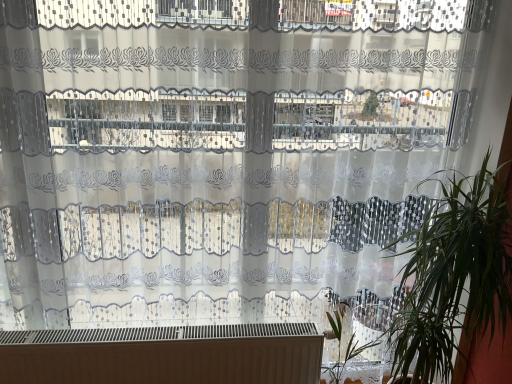
The width and height of the screenshot is (512, 384). What are the coordinates of `green leafy plant at right` in the screenshot? It's located at point(454,275).

What is the approximate width of white matte heater at bottom?

white matte heater at bottom is 12.60 centimeters wide.

What are the coordinates of `green leafy plant at right` in the screenshot? It's located at (454, 275).

Is white matte heater at bottom oriented towards green leafy plant at right?

No, white matte heater at bottom is not facing towards green leafy plant at right.

Is there a large distance between white matte heater at bottom and green leafy plant at right?

white matte heater at bottom is near green leafy plant at right, not far away.

From the picture: How different are the orientations of white matte heater at bottom and green leafy plant at right in degrees?

The angle between the facing direction of white matte heater at bottom and the facing direction of green leafy plant at right is 0.516 degrees.

Based on the photo, between white matte heater at bottom and green leafy plant at right, which one appears on the left side from the viewer's perspective?

white matte heater at bottom.

Are green leafy plant at lower right and white matte heater at bottom located far from each other?

green leafy plant at lower right is actually quite close to white matte heater at bottom.

From the image's perspective, is green leafy plant at lower right over white matte heater at bottom?

Indeed, from the image's perspective, green leafy plant at lower right is shown above white matte heater at bottom.

Is green leafy plant at lower right wider or thinner than white matte heater at bottom?

Clearly, green leafy plant at lower right has more width compared to white matte heater at bottom.

Is green leafy plant at lower right turned away from white matte heater at bottom?

Yes, green leafy plant at lower right is positioned with its back facing white matte heater at bottom.

From a real-world perspective, which is physically below, green leafy plant at right or white matte heater at bottom?

white matte heater at bottom.

Who is bigger, green leafy plant at right or white matte heater at bottom?

Bigger between the two is green leafy plant at right.

Do you think green leafy plant at right is within white matte heater at bottom, or outside of it?

green leafy plant at right lies outside white matte heater at bottom.

How many degrees apart are the facing directions of green leafy plant at right and white matte heater at bottom?

They differ by 0.516 degrees in their facing directions.

Between green leafy plant at lower right and green leafy plant at right, which one appears on the right side from the viewer's perspective?

From the viewer's perspective, green leafy plant at right appears more on the right side.

From the image's perspective, is green leafy plant at lower right above or below green leafy plant at right?

From the image's perspective, green leafy plant at lower right appears below green leafy plant at right.

Can you tell me how much green leafy plant at lower right and green leafy plant at right differ in facing direction?

green leafy plant at lower right and green leafy plant at right are facing 5.38e-05 degrees away from each other.

Between green leafy plant at lower right and green leafy plant at right, which one is positioned in front?

Positioned in front is green leafy plant at right.

Does green leafy plant at right appear on the right side of green leafy plant at lower right?

Correct, you'll find green leafy plant at right to the right of green leafy plant at lower right.

Is green leafy plant at right not close to green leafy plant at lower right?

No, green leafy plant at right is not far away from green leafy plant at lower right.

Is green leafy plant at right bigger or smaller than green leafy plant at lower right?

green leafy plant at right is bigger than green leafy plant at lower right.

Considering the sizes of objects green leafy plant at right and green leafy plant at lower right in the image provided, who is wider, green leafy plant at right or green leafy plant at lower right?

With larger width is green leafy plant at right.

Is green leafy plant at lower right surrounded by white matte heater at bottom?

No, white matte heater at bottom does not contain green leafy plant at lower right.

From a real-world perspective, is white matte heater at bottom located beneath green leafy plant at lower right?

Correct, in the physical world, white matte heater at bottom is lower than green leafy plant at lower right.

Which object is closer to the camera, white matte heater at bottom or green leafy plant at lower right?

green leafy plant at lower right is in front.

From the image's perspective, is white matte heater at bottom located above green leafy plant at lower right?

No, from the image's perspective, white matte heater at bottom is not on top of green leafy plant at lower right.

You are a GUI agent. You are given a task and a screenshot of the screen. Output one action in this format:
    pyautogui.click(x=<x>, y=<y>)
    Task: Click on the houseplant above the white matte heater at bottom (from the image's perspective)
    Image resolution: width=512 pixels, height=384 pixels.
    Given the screenshot: What is the action you would take?
    pyautogui.click(x=454, y=275)

Locate an element on the screen. This screenshot has height=384, width=512. vegetation that appears above the white matte heater at bottom (from a real-world perspective) is located at coordinates (340, 345).

Which object lies nearer to the anchor point green leafy plant at right, white matte heater at bottom or green leafy plant at lower right?

green leafy plant at lower right is closer to green leafy plant at right.

Considering their positions, is green leafy plant at right positioned closer to green leafy plant at lower right than white matte heater at bottom?

green leafy plant at right is closer to green leafy plant at lower right.

Looking at the image, which one is located closer to green leafy plant at lower right, white matte heater at bottom or green leafy plant at right?

green leafy plant at right is closer to green leafy plant at lower right.

Based on their spatial positions, is green leafy plant at lower right or white matte heater at bottom closer to green leafy plant at right?

green leafy plant at lower right is positioned closer to the anchor green leafy plant at right.

Estimate the real-world distances between objects in this image. Which object is closer to white matte heater at bottom, green leafy plant at lower right or green leafy plant at right?

green leafy plant at lower right lies closer to white matte heater at bottom than the other object.

Estimate the real-world distances between objects in this image. Which object is closer to white matte heater at bottom, green leafy plant at right or green leafy plant at lower right?

Among the two, green leafy plant at lower right is located nearer to white matte heater at bottom.

You are a GUI agent. You are given a task and a screenshot of the screen. Output one action in this format:
    pyautogui.click(x=<x>, y=<y>)
    Task: Click on the vegetation between white matte heater at bottom and green leafy plant at right
    The image size is (512, 384).
    Given the screenshot: What is the action you would take?
    pyautogui.click(x=340, y=345)